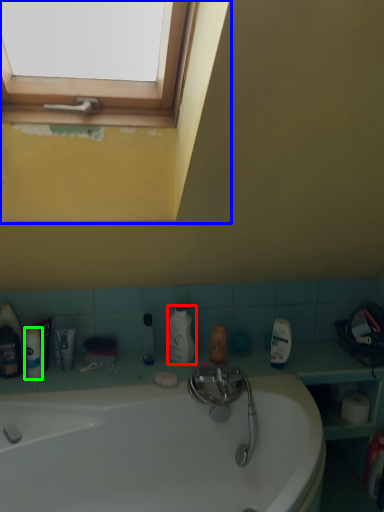
Question: Considering the real-world distances, which object is farthest from cleaning product (highlighted by a red box)? window frame (highlighted by a blue box) or toiletry (highlighted by a green box)?

Choices:
 (A) window frame
 (B) toiletry

Answer: (A)